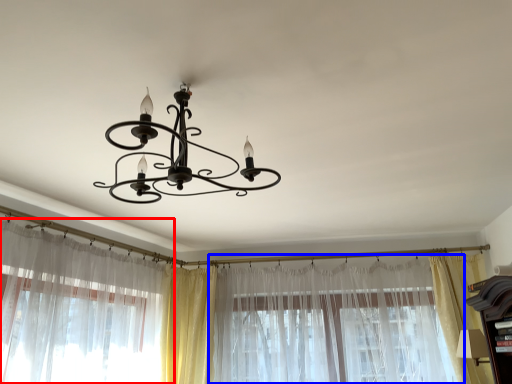
Question: Which point is closer to the camera, curtain (highlighted by a red box) or curtain (highlighted by a blue box)?

Choices:
 (A) curtain
 (B) curtain

Answer: (A)